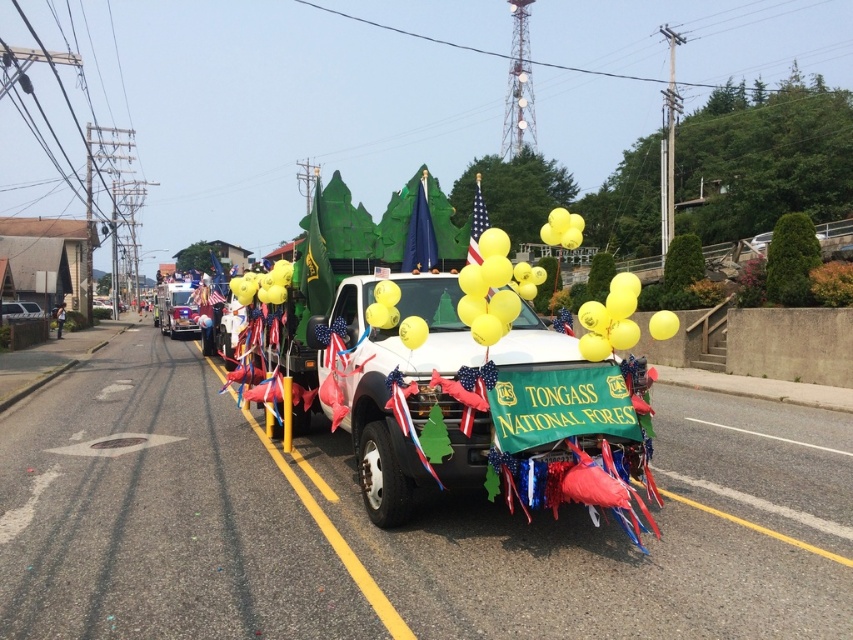
Is white glossy pickup truck at center below american flag at center?

Yes, white glossy pickup truck at center is below american flag at center.

Does white glossy pickup truck at center have a greater width compared to american flag at center?

In fact, white glossy pickup truck at center might be narrower than american flag at center.

Identify the location of white glossy pickup truck at center. (479, 401).

Find the location of `white glossy pickup truck at center`. white glossy pickup truck at center is located at coordinates (479, 401).

Is point (432, 232) in front of point (189, 285)?

Yes, point (432, 232) is in front of point (189, 285).

Can you confirm if navy blue fabric flag at center is wider than shiny silver firetruck at center?

In fact, navy blue fabric flag at center might be narrower than shiny silver firetruck at center.

Is point (410, 212) farther from viewer compared to point (163, 321)?

No.

The height and width of the screenshot is (640, 853). Find the location of `navy blue fabric flag at center`. navy blue fabric flag at center is located at coordinates (419, 236).

Is white glossy pickup truck at center thinner than navy blue fabric flag at center?

Incorrect, white glossy pickup truck at center's width is not less than navy blue fabric flag at center's.

Is point (325, 365) closer to camera compared to point (415, 266)?

Yes, it is in front of point (415, 266).

Who is more distant from viewer, (602, 483) or (407, 268)?

Point (407, 268)

Where is `white glossy pickup truck at center`? This screenshot has height=640, width=853. white glossy pickup truck at center is located at coordinates (479, 401).